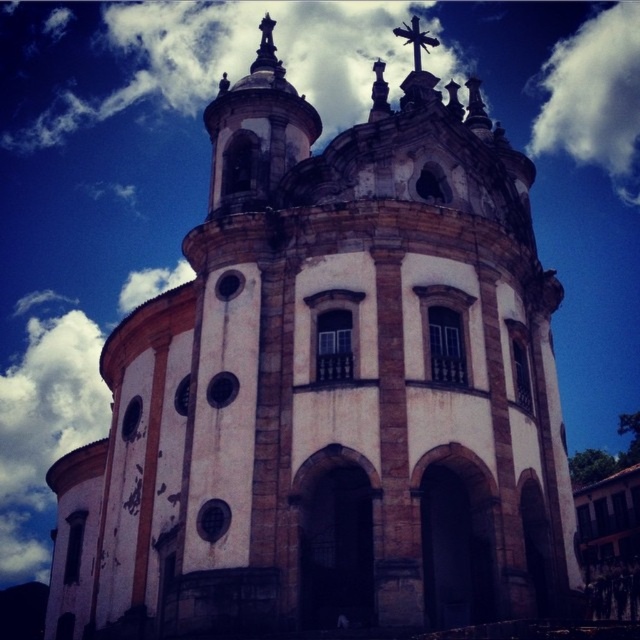
Question: Is white fluffy cloud at upper right below metallic cross at upper center?

Choices:
 (A) yes
 (B) no

Answer: (B)

Question: Is white fluffy cloud at upper right thinner than metallic cross at upper center?

Choices:
 (A) yes
 (B) no

Answer: (B)

Question: Which point is closer to the camera?

Choices:
 (A) metallic cross at upper center
 (B) white fluffy cloud at upper right

Answer: (A)

Question: Does white fluffy cloud at upper right appear under metallic cross at upper center?

Choices:
 (A) yes
 (B) no

Answer: (B)